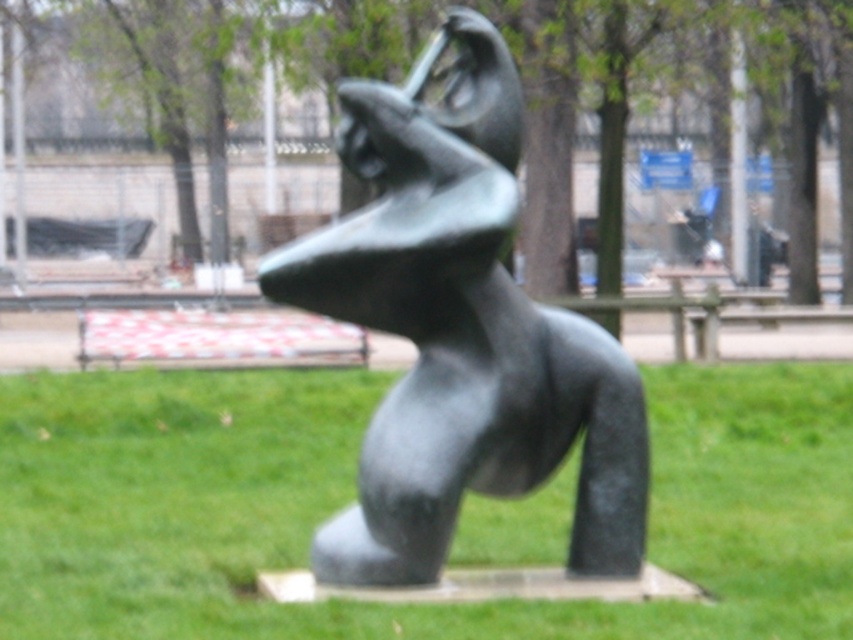
You are standing in the park and see the green grass at center and the bronze sculpture at center. Which object is positioned more to the left from your perspective?

The green grass at center is positioned to the left of the bronze sculpture at center, so it is more to the left.

You are planning to place a new bench in the park. The bench requires a space larger than the bronze sculpture at center. Based on the scene, is there enough space on the green grass at center to accommodate the bench?

The green grass at center has a larger size compared to bronze sculpture at center, so there is enough space to place the bench there.

You are standing in the park looking at the modern abstract sculpture. There are two points marked on the sculpture. The first point is at coordinate point (340,404) and the second point is at coordinate point (500,326). Which of these two points is closer to you?

Point (500,326) is closer to you because it is in front of point (340,404).